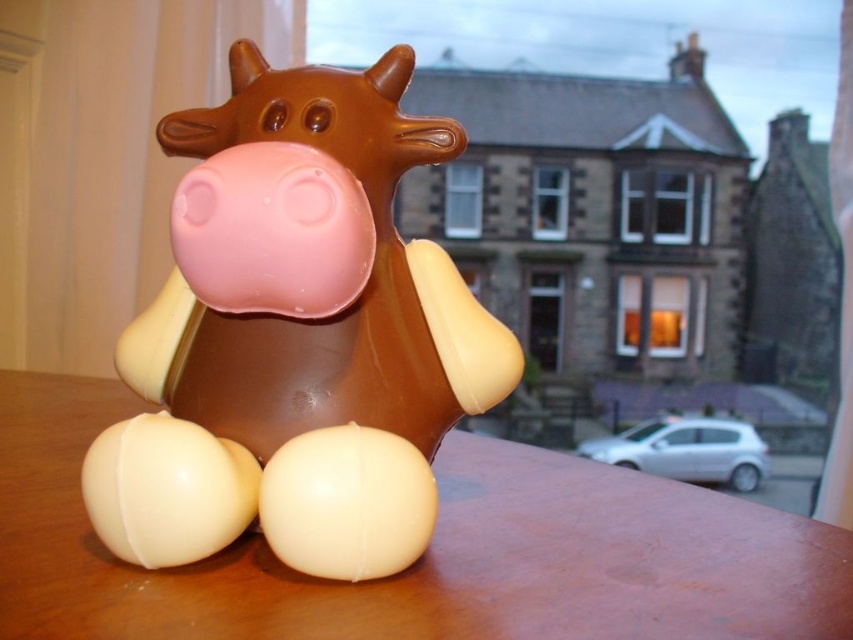
What do you see at coordinates (296, 336) in the screenshot? I see `matte chocolate cow at center` at bounding box center [296, 336].

Can you confirm if matte chocolate cow at center is positioned below wooden table at center?

Incorrect, matte chocolate cow at center is not positioned below wooden table at center.

This screenshot has height=640, width=853. In order to click on matte chocolate cow at center in this screenshot , I will do `click(296, 336)`.